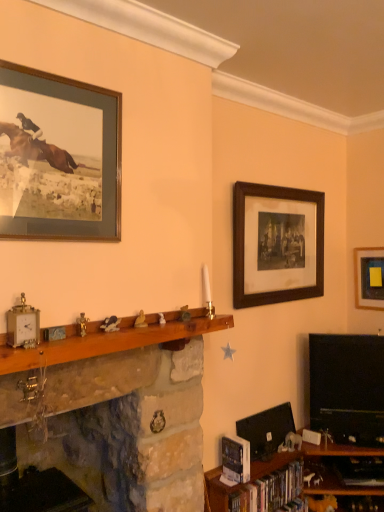
Question: Is hardcover books at lower right wider than wooden shelf at lower right, arranged as the 3th shelf when viewed from the left?

Choices:
 (A) no
 (B) yes

Answer: (A)

Question: Is hardcover books at lower right far away from wooden shelf at lower right, which is counted as the 1th shelf, starting from the right?

Choices:
 (A) yes
 (B) no

Answer: (B)

Question: Does hardcover books at lower right turn towards wooden shelf at lower right, arranged as the 3th shelf when viewed from the left?

Choices:
 (A) no
 (B) yes

Answer: (B)

Question: From a real-world perspective, is hardcover books at lower right on wooden shelf at lower right, which is counted as the 1th shelf, starting from the right?

Choices:
 (A) yes
 (B) no

Answer: (A)

Question: Does hardcover books at lower right lie in front of wooden shelf at lower right, arranged as the 3th shelf when viewed from the left?

Choices:
 (A) yes
 (B) no

Answer: (B)

Question: From the image's perspective, relative to wooden at center, arranged as the second shelf when viewed from the left, is wooden framed print at upper right, positioned as the 2th picture frame in left-to-right order, above or below?

Choices:
 (A) below
 (B) above

Answer: (B)

Question: Based on their sizes in the image, would you say wooden framed print at upper right, which ranks as the second picture frame in right-to-left order, is bigger or smaller than wooden at center, marked as the second shelf in a right-to-left arrangement?

Choices:
 (A) small
 (B) big

Answer: (A)

Question: Is wooden framed print at upper right, which appears as the second picture frame when viewed from the front, in front of or behind wooden at center, marked as the second shelf in a right-to-left arrangement, in the image?

Choices:
 (A) behind
 (B) front

Answer: (A)

Question: Considering the positions of wooden framed print at upper right, positioned as the 2th picture frame in left-to-right order, and wooden at center, marked as the second shelf in a right-to-left arrangement, in the image, is wooden framed print at upper right, positioned as the 2th picture frame in left-to-right order, wider or thinner than wooden at center, marked as the second shelf in a right-to-left arrangement,?

Choices:
 (A) thin
 (B) wide

Answer: (A)

Question: Looking at the image, does wooden at center, arranged as the second shelf when viewed from the left, seem bigger or smaller compared to hardcover books at lower right?

Choices:
 (A) big
 (B) small

Answer: (A)

Question: In the image, is wooden at center, arranged as the second shelf when viewed from the left, on the left side or the right side of hardcover books at lower right?

Choices:
 (A) left
 (B) right

Answer: (A)

Question: Does point (175, 334) appear closer or farther from the camera than point (281, 485)?

Choices:
 (A) closer
 (B) farther

Answer: (A)

Question: Considering the positions of wooden at center, marked as the second shelf in a right-to-left arrangement, and hardcover books at lower right in the image, is wooden at center, marked as the second shelf in a right-to-left arrangement, taller or shorter than hardcover books at lower right?

Choices:
 (A) tall
 (B) short

Answer: (B)

Question: Considering the positions of wooden shelf at lower right, which is counted as the 1th shelf, starting from the right, and black glossy television at right in the image, is wooden shelf at lower right, which is counted as the 1th shelf, starting from the right, wider or thinner than black glossy television at right?

Choices:
 (A) thin
 (B) wide

Answer: (B)

Question: From a real-world perspective, is wooden shelf at lower right, which is counted as the 1th shelf, starting from the right, positioned above or below black glossy television at right?

Choices:
 (A) below
 (B) above

Answer: (A)